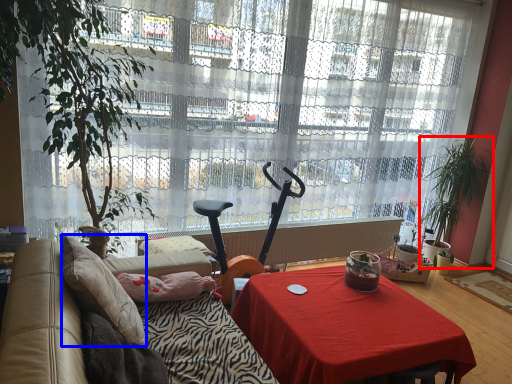
Question: Among these objects, which one is farthest to the camera, houseplant (highlighted by a red box) or pillow (highlighted by a blue box)?

Choices:
 (A) houseplant
 (B) pillow

Answer: (A)